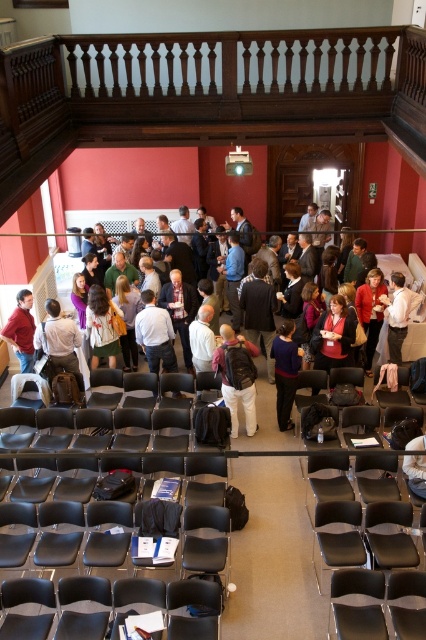
You are standing at the back of the lecture hall and want to take a photo of two specific points in the room. The first point is at coordinates point (157, 474) and the second is at point (337, 632). Which point will appear closer to you in the photo?

Point (157, 474) is further to the camera than point (337, 632), so in the photo, point (337, 632) will appear closer to you.